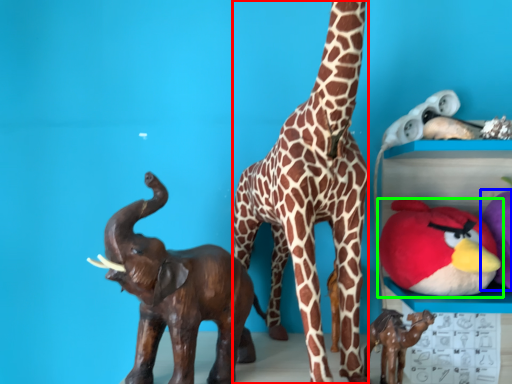
Question: Considering the real-world distances, which object is closest to giraffe (highlighted by a red box)? toy (highlighted by a blue box) or toy (highlighted by a green box).

Choices:
 (A) toy
 (B) toy

Answer: (B)